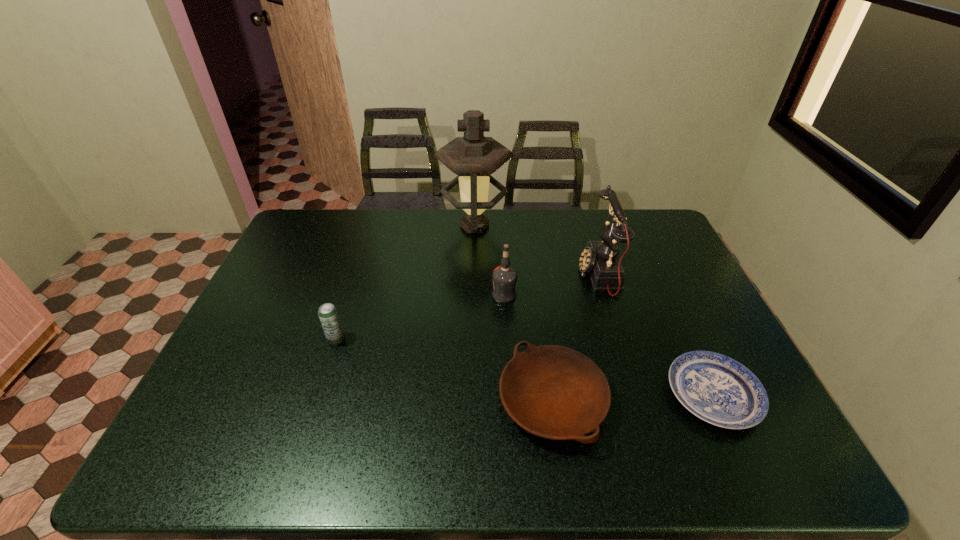
Find the location of a particular element. This screenshot has height=540, width=960. the farthest object is located at coordinates (473, 157).

Identify the location of the tallest object. Image resolution: width=960 pixels, height=540 pixels. (473, 157).

Where is `the second tallest object`? the second tallest object is located at coordinates 600,259.

Where is `the fifth object from left to right`? The height and width of the screenshot is (540, 960). the fifth object from left to right is located at coordinates (600, 259).

Locate an element on the screen. Image resolution: width=960 pixels, height=540 pixels. vodka is located at coordinates (504, 277).

Image resolution: width=960 pixels, height=540 pixels. In order to click on the third nearest object in this screenshot , I will do `click(328, 314)`.

This screenshot has height=540, width=960. Identify the location of the leftmost object. (328, 314).

The height and width of the screenshot is (540, 960). In order to click on the second shortest object in this screenshot , I will do `click(554, 392)`.

The image size is (960, 540). What are the coordinates of `the taller plate` in the screenshot? It's located at (554, 392).

Where is `the right plate`? The height and width of the screenshot is (540, 960). the right plate is located at coordinates (719, 390).